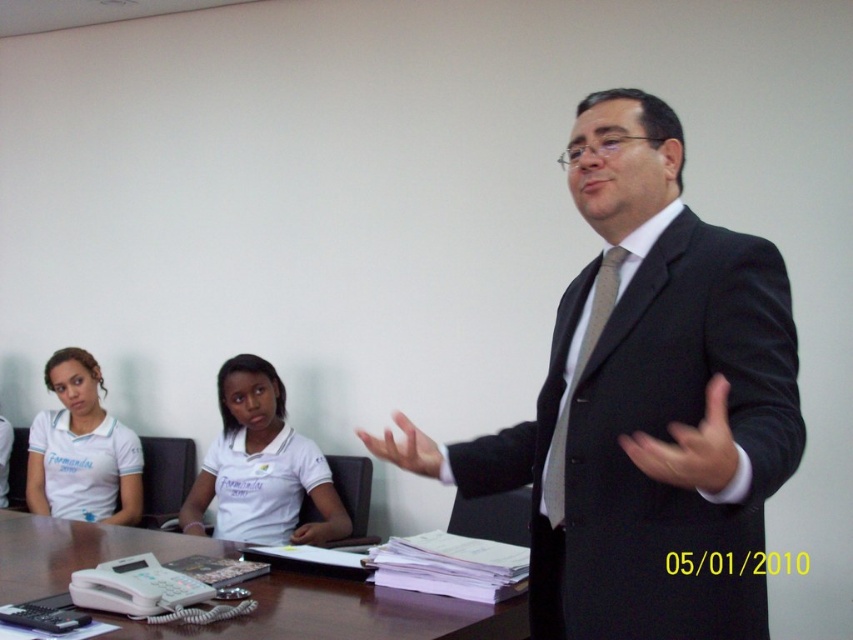
You are an event planner observing the scene. You need to ensure that all participants are visible to the audience. The black suit at center and white cotton shirt at center are part of the speaker and audience members. Which one should be placed in the front row to ensure visibility?

The black suit at center has a greater height compared to the white cotton shirt at center. Therefore, the individual wearing the black suit at center should be placed in the front row to ensure better visibility since taller individuals can be seen more easily by the audience.

Consider the image. You are a photographer standing at the back of the room. You want to take a clear photo of the black suit at center without including the seated individuals in the background. Is the distance sufficient to ensure the subject is in focus?

The black suit at center is 3.30 feet away from the camera. Since the photographer is standing at the back, this distance may be too close for a clear photo without including the background individuals. Adjusting the camera settings or moving further back might be necessary.